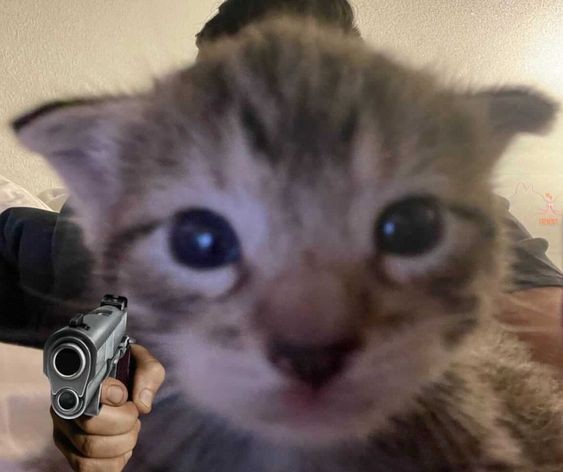
I want to click on wall, so click(487, 41).